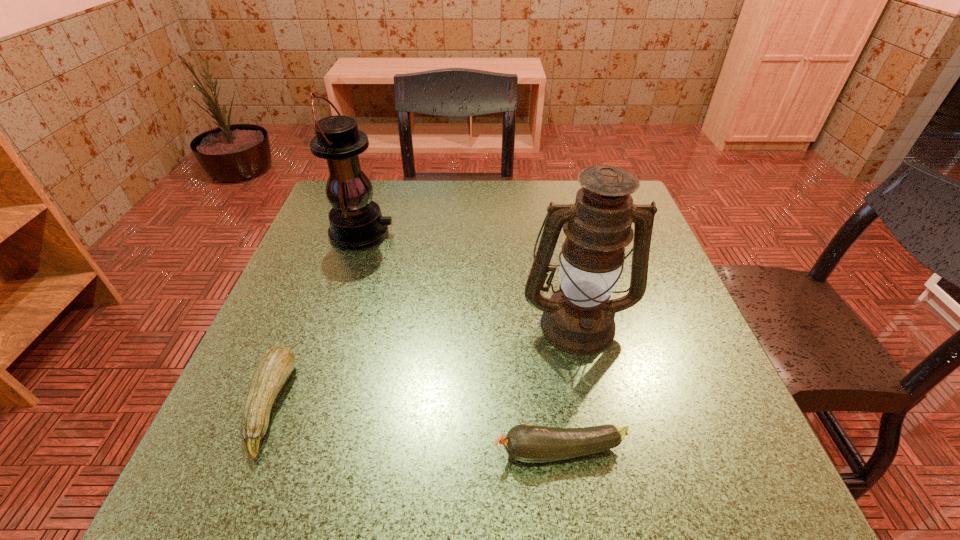
Identify the location of object positioned at the far edge. (356, 222).

I want to click on lantern that is at the left edge, so click(356, 222).

The width and height of the screenshot is (960, 540). What are the coordinates of `zucchini that is at the left edge` in the screenshot? It's located at (272, 371).

Identify the location of object that is at the right edge. The image size is (960, 540). (579, 318).

Where is `object present at the far left corner`? object present at the far left corner is located at coordinates (356, 222).

Identify the location of object located at the near left corner. This screenshot has width=960, height=540. (272, 371).

In order to click on free region at the far edge in this screenshot , I will do `click(560, 200)`.

In the image, there is a desktop. Identify the location of vacant space at the near edge. The image size is (960, 540). (655, 503).

This screenshot has height=540, width=960. In the image, there is a desktop. Find the location of `blank space at the left edge`. blank space at the left edge is located at coordinates (352, 268).

Where is `vacant area at the right edge of the desktop`? Image resolution: width=960 pixels, height=540 pixels. vacant area at the right edge of the desktop is located at coordinates point(722,382).